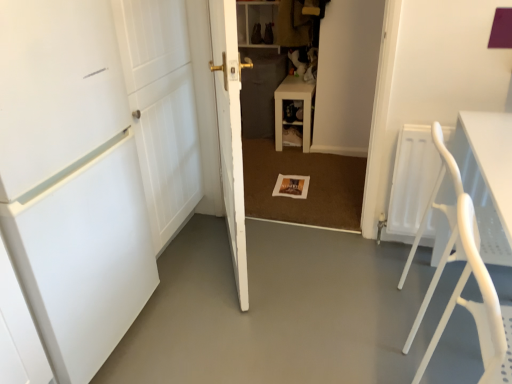
Where is `vacant space in front of white matte door at center, the 1th door from the right`? This screenshot has width=512, height=384. vacant space in front of white matte door at center, the 1th door from the right is located at coordinates click(242, 326).